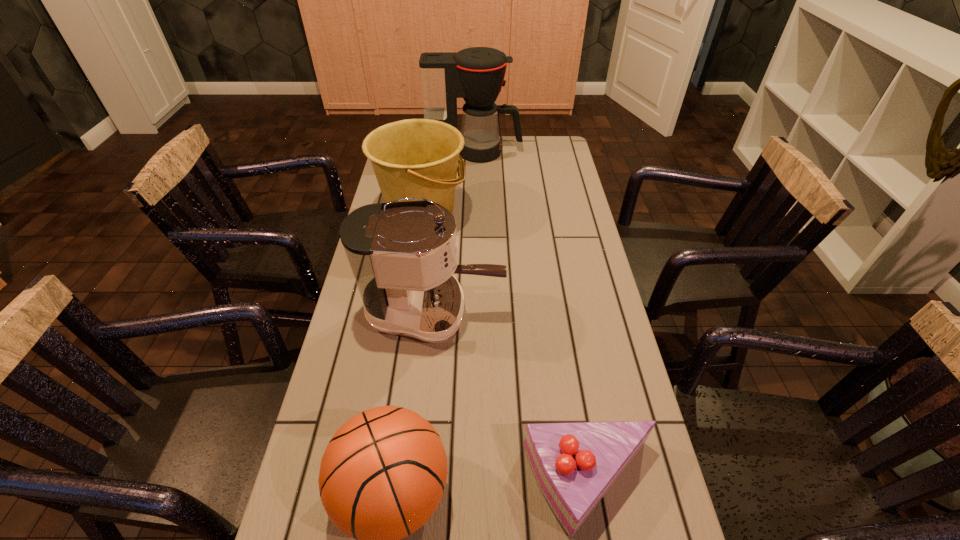
Identify the location of bucket present at the left edge. (414, 158).

Where is `object that is at the right edge`? Image resolution: width=960 pixels, height=540 pixels. object that is at the right edge is located at coordinates (575, 464).

You are a GUI agent. You are given a task and a screenshot of the screen. Output one action in this format:
    pyautogui.click(x=<x>, y=<y>)
    Task: Click on the object that is at the far left corner
    The width and height of the screenshot is (960, 540).
    Given the screenshot: What is the action you would take?
    pyautogui.click(x=476, y=74)

This screenshot has width=960, height=540. Identify the location of free space at the left edge. (372, 345).

In the image, there is a desktop. What are the coordinates of `free space at the right edge` in the screenshot? It's located at (x=643, y=492).

You are a GUI agent. You are given a task and a screenshot of the screen. Output one action in this format:
    pyautogui.click(x=<x>, y=<y>)
    Task: Click on the free space at the far right corner of the desktop
    
    Given the screenshot: What is the action you would take?
    pyautogui.click(x=548, y=137)

I want to click on unoccupied position between the cake and the farthest object, so click(533, 319).

Identify the location of free space that is in between the shortest object and the third tallest object. (506, 350).

The height and width of the screenshot is (540, 960). Identify the location of vacant area that lies between the shortest object and the bucket. (506, 350).

Locate an element on the screen. Image resolution: width=960 pixels, height=540 pixels. free space between the farther coffee maker and the shortest object is located at coordinates (533, 319).